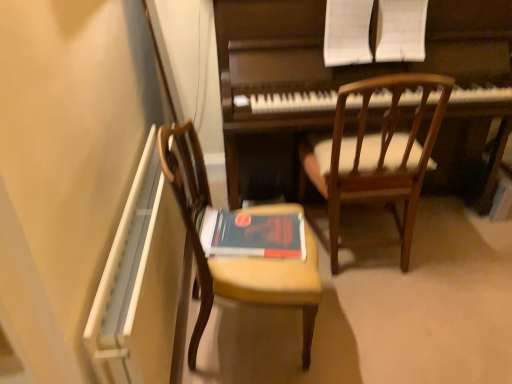
The image size is (512, 384). What are the coordinates of `empty space that is to the right of wooden chair at upper right, the second chair from the left` in the screenshot? It's located at click(461, 261).